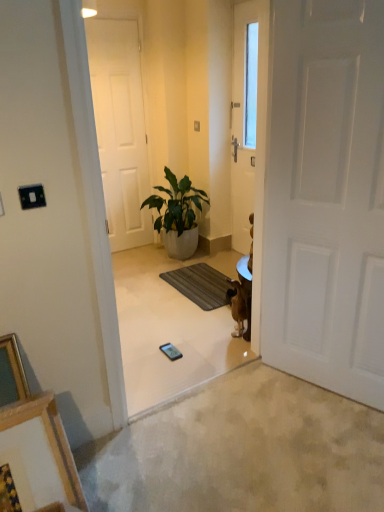
The width and height of the screenshot is (384, 512). I want to click on vacant space behind brown fur dog at center-right, so click(222, 322).